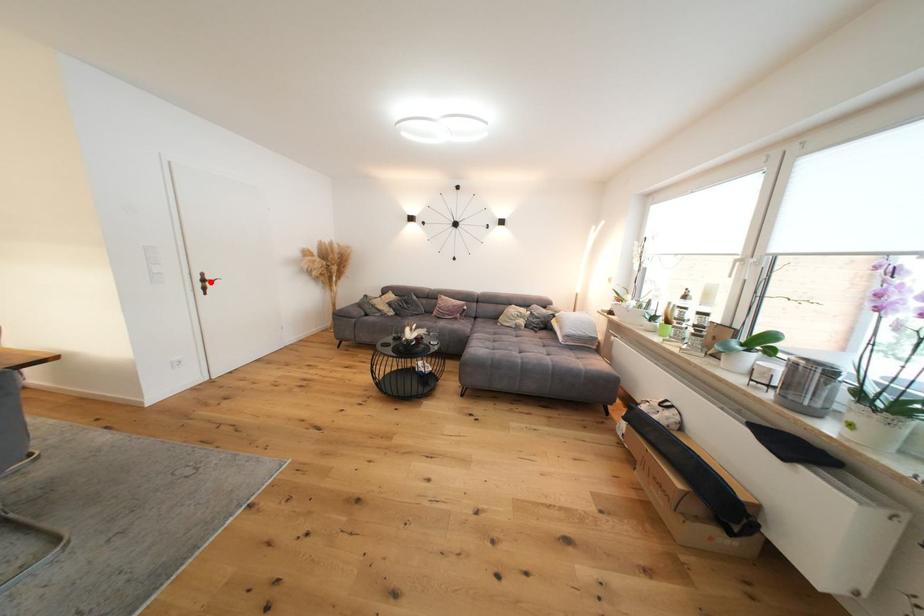
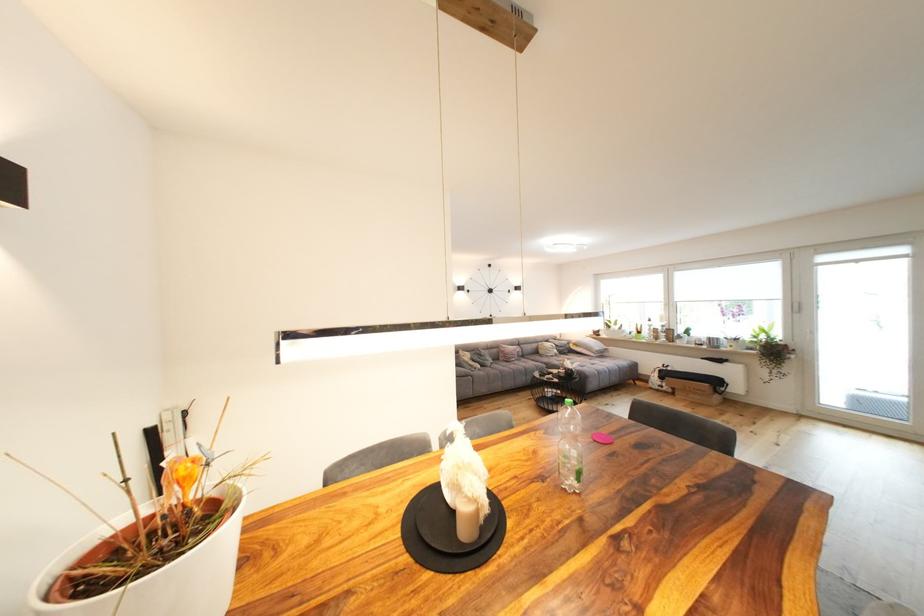
Question: I am providing you with two images of the same scene from different viewpoints. A red point is marked on the first image. Is the red point's position out of view in image 2?

Choices:
 (A) Yes
 (B) No

Answer: (A)